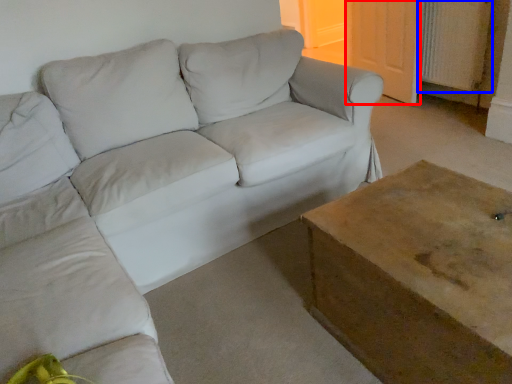
Question: Which of the following is the closest to the observer, door (highlighted by a red box) or radiator (highlighted by a blue box)?

Choices:
 (A) door
 (B) radiator

Answer: (B)